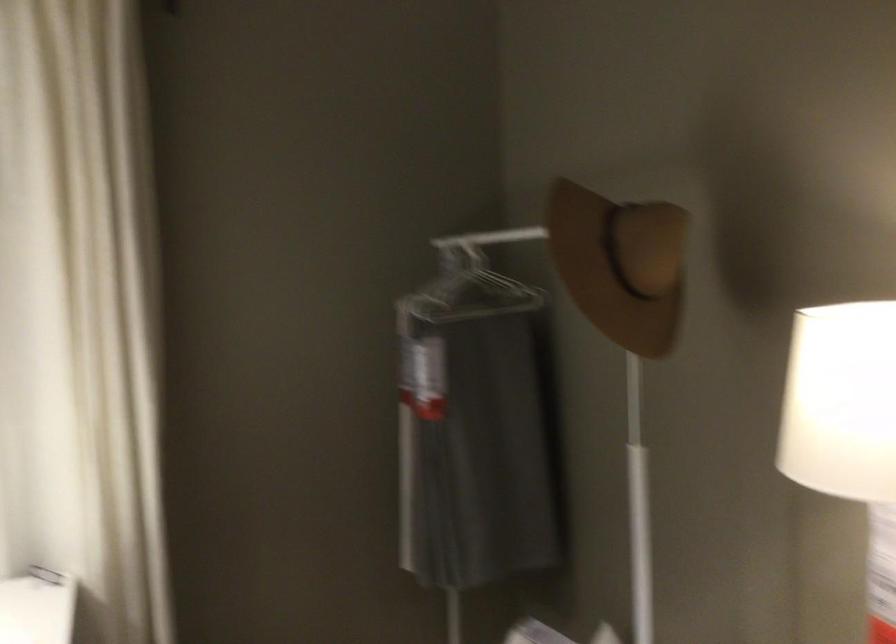
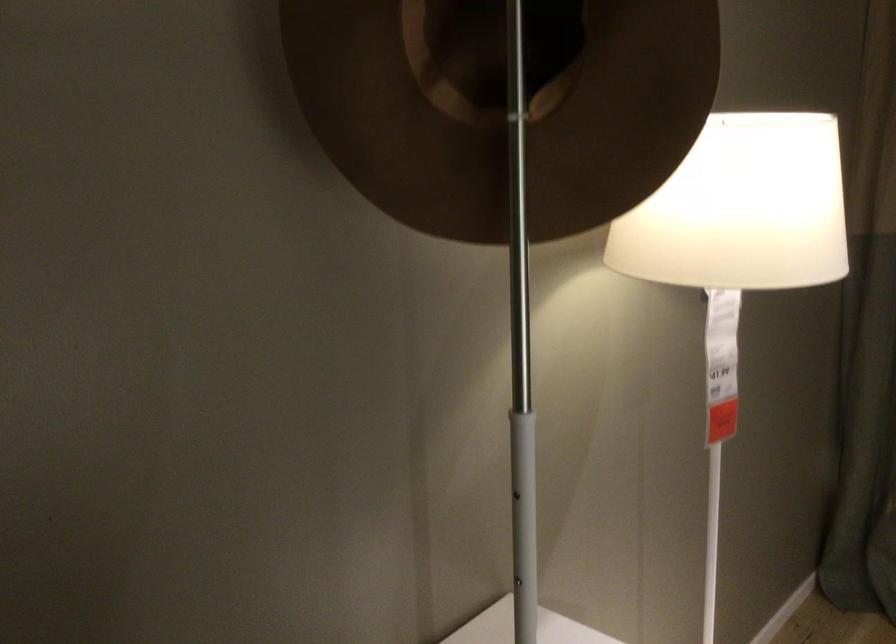
Locate, in the second image, the point that corresponds to point 673,286 in the first image.

(501, 108)